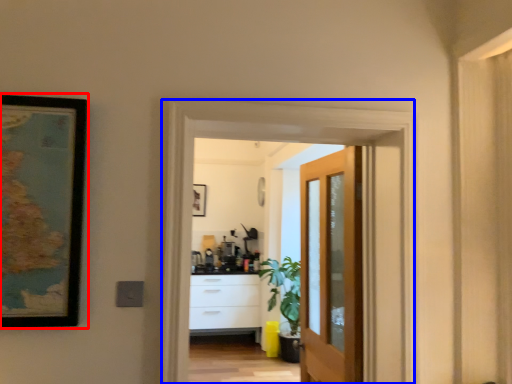
Question: Which object is closer to the camera taking this photo, picture frame (highlighted by a red box) or screen door (highlighted by a blue box)?

Choices:
 (A) picture frame
 (B) screen door

Answer: (A)